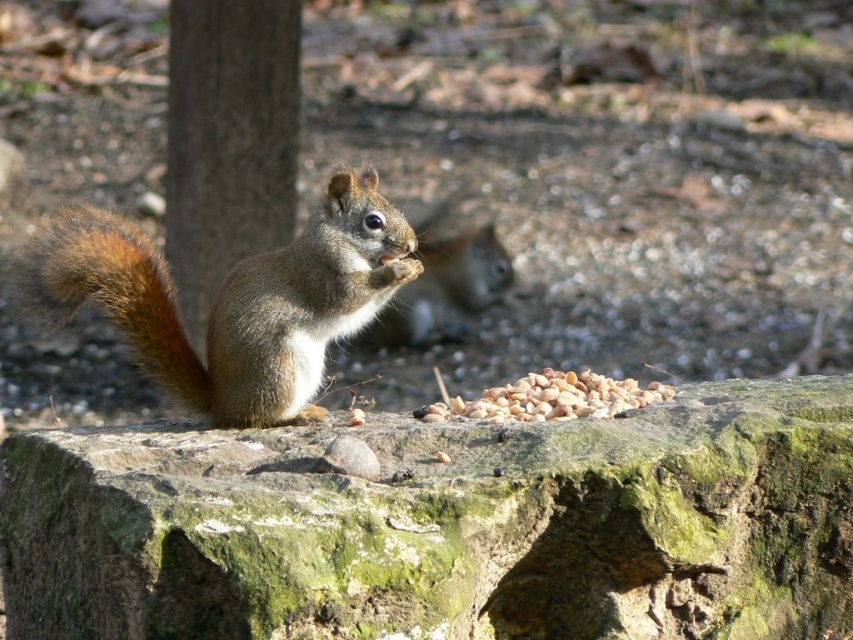
Question: Is brown fur squirrel at center to the left of brown rough bark at left from the viewer's perspective?

Choices:
 (A) no
 (B) yes

Answer: (A)

Question: Which of the following is the closest to the observer?

Choices:
 (A) brown rough bark at left
 (B) green mossy stone at center
 (C) brown fur squirrel at center
 (D) shiny brown fur squirrel at center

Answer: (B)

Question: Considering the relative positions of green mossy stone at center and shiny brown fur squirrel at center in the image provided, where is green mossy stone at center located with respect to shiny brown fur squirrel at center?

Choices:
 (A) below
 (B) above

Answer: (A)

Question: Which point is farther to the camera?

Choices:
 (A) brown furry tail at left
 (B) brown fur squirrel at center
 (C) shiny brown fur squirrel at center

Answer: (C)

Question: Can you confirm if brown rough bark at left is thinner than brown furry tail at left?

Choices:
 (A) no
 (B) yes

Answer: (A)

Question: Which object is farther from the camera taking this photo?

Choices:
 (A) green mossy stone at center
 (B) shiny brown fur squirrel at center
 (C) brown fur squirrel at center

Answer: (B)